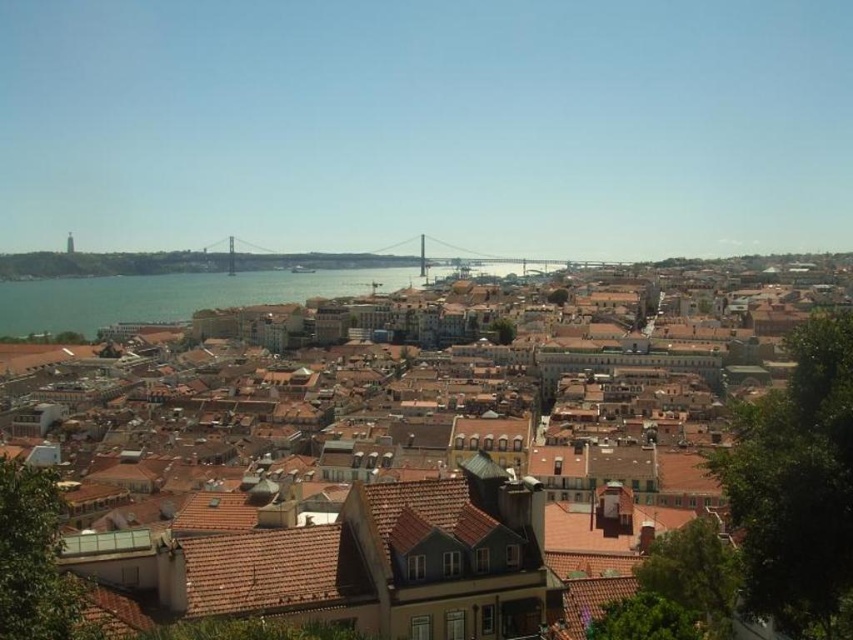
Question: Which of the following is the closest to the observer?

Choices:
 (A) (198, 509)
 (B) (300, 266)

Answer: (A)

Question: Which of the following is the closest to the observer?

Choices:
 (A) pos(537,621)
 (B) pos(248,257)

Answer: (A)

Question: Does brown tiled roofs at center lie behind silver metallic bridge at center?

Choices:
 (A) yes
 (B) no

Answer: (B)

Question: Is brown tiled roofs at center above silver metallic bridge at center?

Choices:
 (A) yes
 (B) no

Answer: (B)

Question: Which object is closer to the camera taking this photo?

Choices:
 (A) brown tiled roofs at center
 (B) silver metallic bridge at center

Answer: (A)

Question: In this image, where is brown tiled roofs at center located relative to silver metallic bridge at center?

Choices:
 (A) left
 (B) right

Answer: (B)